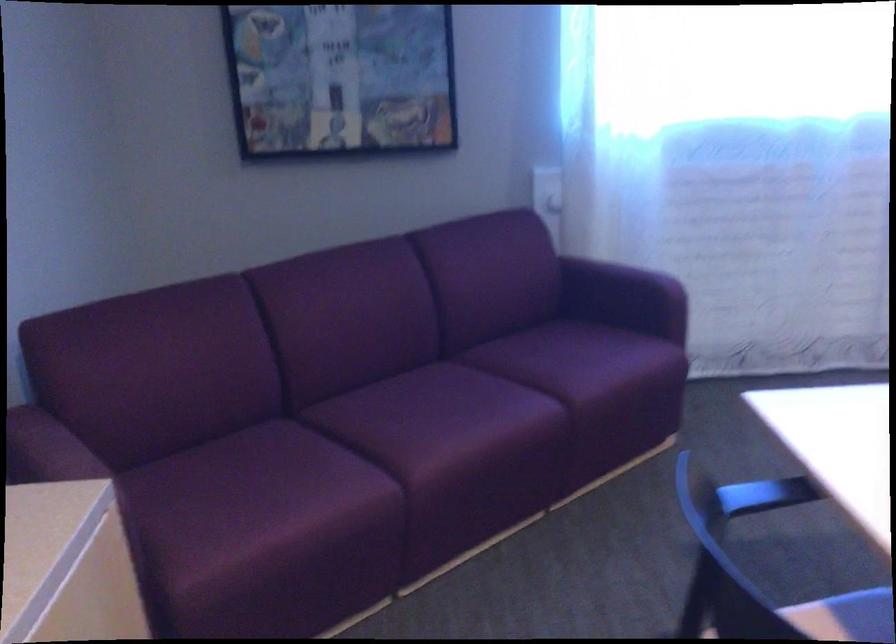
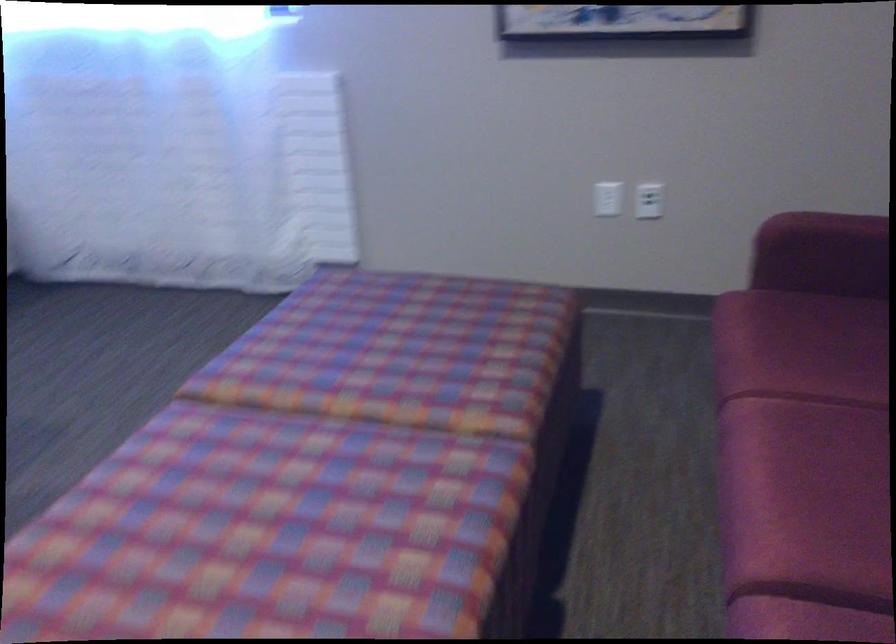
Question: In a continuous first-person perspective shot, in which direction is the camera moving?

Choices:
 (A) Left
 (B) Right
 (C) Forward
 (D) Backward

Answer: (B)